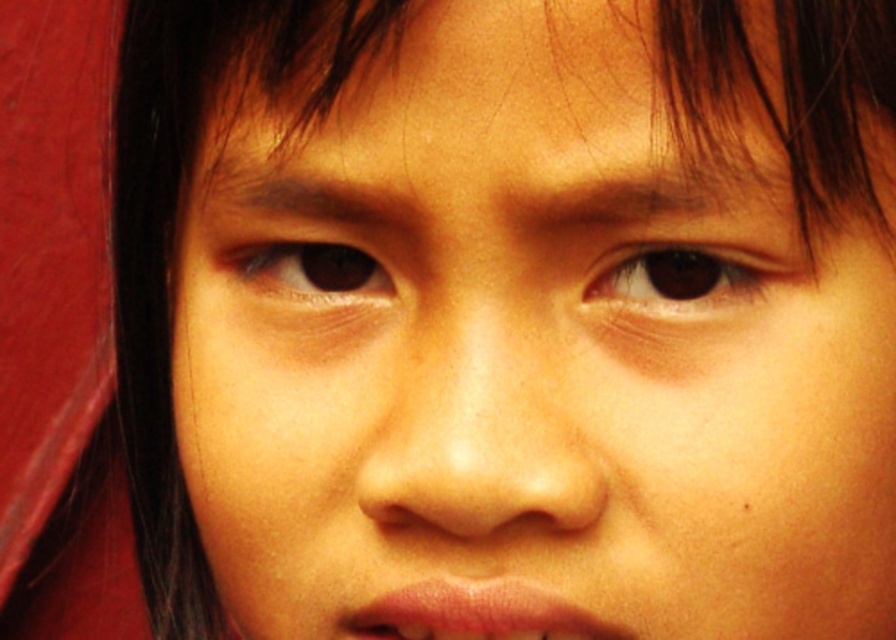
Question: In this image, where is brown matte eye at upper center located relative to brown matte eye at center?

Choices:
 (A) right
 (B) left

Answer: (A)

Question: Which point is closer to the camera?

Choices:
 (A) (666, 272)
 (B) (313, 241)

Answer: (A)

Question: Does brown matte eye at upper center have a larger size compared to brown matte eye at center?

Choices:
 (A) no
 (B) yes

Answer: (A)

Question: Among these objects, which one is nearest to the camera?

Choices:
 (A) brown matte eye at upper center
 (B) brown matte eye at center

Answer: (A)

Question: Does brown matte eye at upper center have a larger size compared to brown matte eye at center?

Choices:
 (A) yes
 (B) no

Answer: (B)